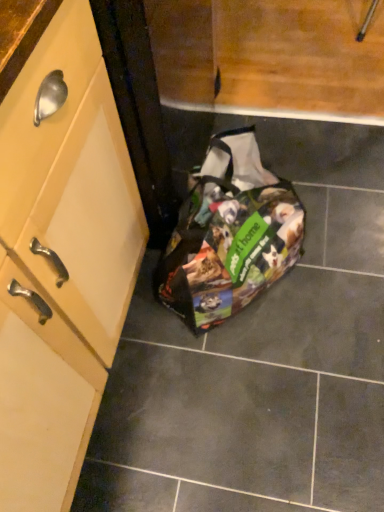
Find the location of `free space on the front side of printed fabric bag at lower center`. free space on the front side of printed fabric bag at lower center is located at coordinates (268, 381).